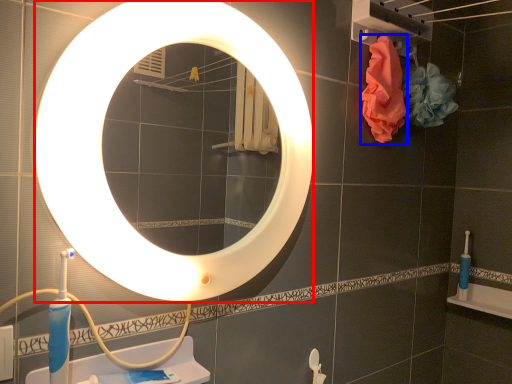
Question: Which object is closer to the camera taking this photo, mirror (highlighted by a red box) or material (highlighted by a blue box)?

Choices:
 (A) mirror
 (B) material

Answer: (A)